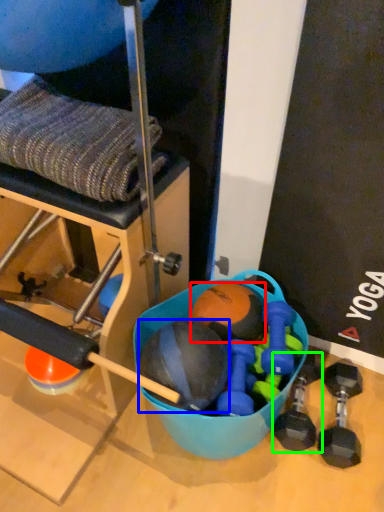
Question: Estimate the real-world distances between objects in this image. Which object is farther from ball (highlighted by a red box), ball (highlighted by a blue box) or dumbbell (highlighted by a green box)?

Choices:
 (A) ball
 (B) dumbbell

Answer: (B)